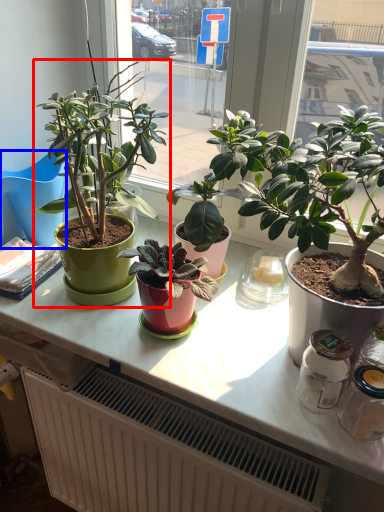
Question: Which object is further to the camera taking this photo, houseplant (highlighted by a red box) or chair (highlighted by a blue box)?

Choices:
 (A) houseplant
 (B) chair

Answer: (B)